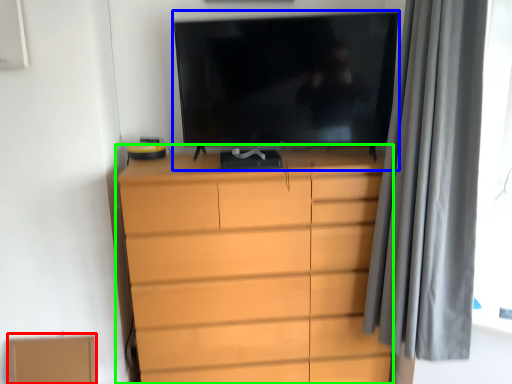
Question: Estimate the real-world distances between objects in this image. Which object is farther from cardboard box (highlighted by a red box), television (highlighted by a blue box) or chest of drawers (highlighted by a green box)?

Choices:
 (A) television
 (B) chest of drawers

Answer: (A)